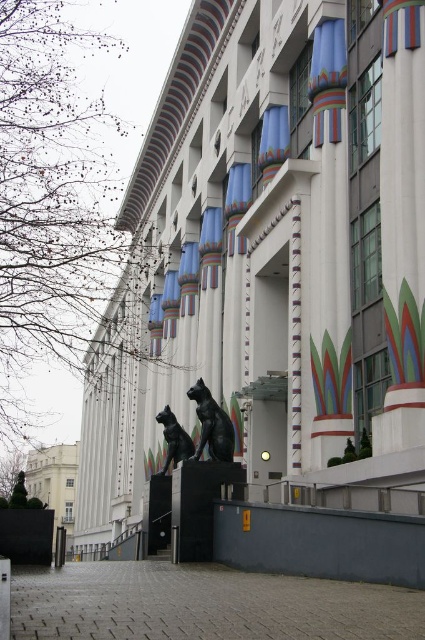
Could you measure the distance between blue fabric curtain at upper center and black polished stone cat at lower center?

34.24 meters

Which is below, blue fabric curtain at upper center or black polished stone cat at lower center?

Positioned lower is black polished stone cat at lower center.

At what (x,y) coordinates should I click in order to perform the action: click on blue fabric curtain at upper center. Please return your answer as a coordinate pair (x, y). The width and height of the screenshot is (425, 640). Looking at the image, I should click on (328, 77).